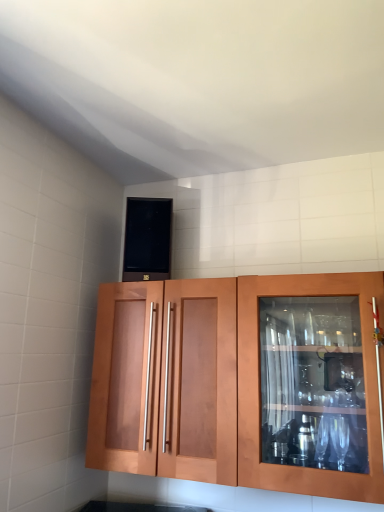
Question: Based on their sizes in the image, would you say matte wood cabinet at center is bigger or smaller than black matte speaker at upper center?

Choices:
 (A) big
 (B) small

Answer: (A)

Question: Considering the relative positions of matte wood cabinet at center and black matte speaker at upper center in the image provided, is matte wood cabinet at center to the left or to the right of black matte speaker at upper center?

Choices:
 (A) right
 (B) left

Answer: (A)

Question: In the image, is matte wood cabinet at center positioned in front of or behind black matte speaker at upper center?

Choices:
 (A) behind
 (B) front

Answer: (B)

Question: Is black matte speaker at upper center taller or shorter than matte wood cabinet at center?

Choices:
 (A) short
 (B) tall

Answer: (A)

Question: Considering the positions of black matte speaker at upper center and matte wood cabinet at center in the image, is black matte speaker at upper center bigger or smaller than matte wood cabinet at center?

Choices:
 (A) big
 (B) small

Answer: (B)

Question: From a real-world perspective, is black matte speaker at upper center physically located above or below matte wood cabinet at center?

Choices:
 (A) above
 (B) below

Answer: (A)

Question: Which is correct: black matte speaker at upper center is inside matte wood cabinet at center, or outside of it?

Choices:
 (A) outside
 (B) inside

Answer: (A)